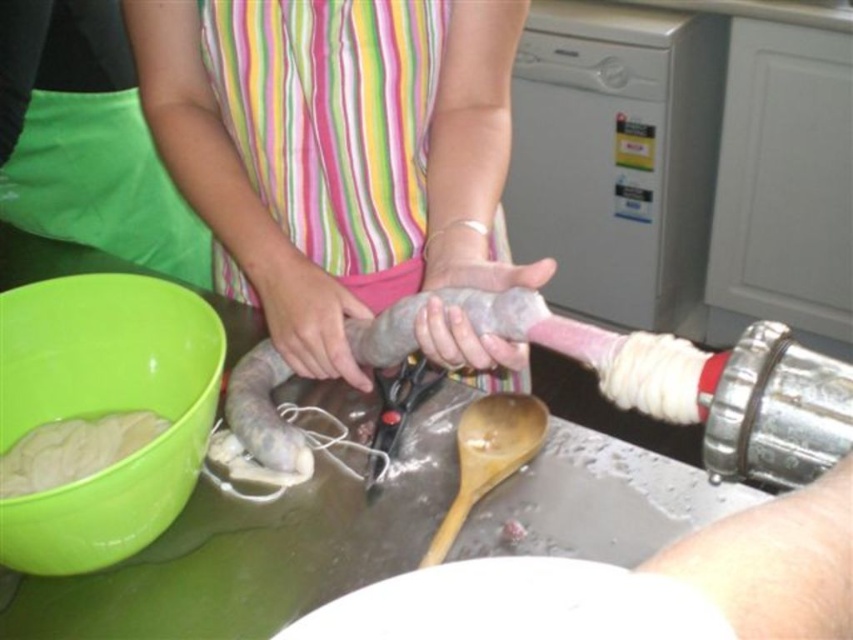
Question: Does pink rubber sausage at center appear over white matte dough at lower left?

Choices:
 (A) no
 (B) yes

Answer: (B)

Question: Which point is closer to the camera?

Choices:
 (A) (619, 632)
 (B) (138, 428)

Answer: (A)

Question: Can you confirm if pink rubber sausage at center is thinner than wooden spoon at center?

Choices:
 (A) yes
 (B) no

Answer: (B)

Question: Estimate the real-world distances between objects in this image. Which object is closer to the white matte bowl at lower center?

Choices:
 (A) white matte dough at lower left
 (B) pink rubber sausage at center

Answer: (B)

Question: Does pink rubber sausage at center have a greater width compared to green plastic bowl at lower left?

Choices:
 (A) no
 (B) yes

Answer: (B)

Question: Which point is closer to the camera taking this photo?

Choices:
 (A) (59, 483)
 (B) (527, 454)
 (C) (387, 634)

Answer: (C)